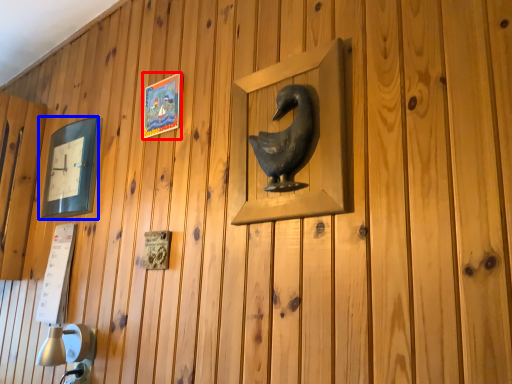
Question: Which object is further to the camera taking this photo, picture frame (highlighted by a red box) or picture frame (highlighted by a blue box)?

Choices:
 (A) picture frame
 (B) picture frame

Answer: (B)